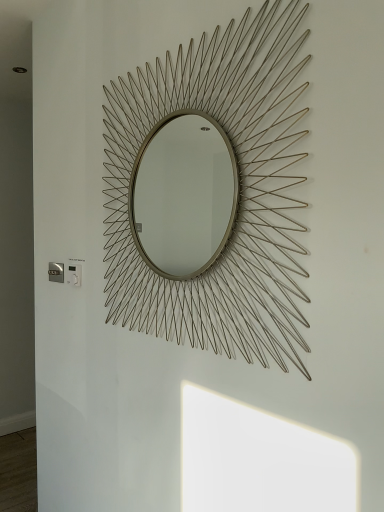
Question: Can you confirm if metallic silver electric outlet at lower left, which appears as the 1th electric outlet when viewed from the back, is shorter than white plastic electric outlet at lower left, which is counted as the 1th electric outlet, starting from the right?

Choices:
 (A) yes
 (B) no

Answer: (A)

Question: Considering the relative sizes of metallic silver electric outlet at lower left, positioned as the second electric outlet in right-to-left order, and white plastic electric outlet at lower left, marked as the first electric outlet in a front-to-back arrangement, in the image provided, is metallic silver electric outlet at lower left, positioned as the second electric outlet in right-to-left order, wider than white plastic electric outlet at lower left, marked as the first electric outlet in a front-to-back arrangement,?

Choices:
 (A) yes
 (B) no

Answer: (B)

Question: Is metallic silver electric outlet at lower left, which appears as the 1th electric outlet when viewed from the back, not close to white plastic electric outlet at lower left, marked as the first electric outlet in a front-to-back arrangement?

Choices:
 (A) no
 (B) yes

Answer: (A)

Question: Does metallic silver electric outlet at lower left, which is the first electric outlet in left-to-right order, have a smaller size compared to white plastic electric outlet at lower left, marked as the first electric outlet in a front-to-back arrangement?

Choices:
 (A) yes
 (B) no

Answer: (B)

Question: Considering the relative sizes of metallic silver electric outlet at lower left, which is the first electric outlet in left-to-right order, and white plastic electric outlet at lower left, marked as the first electric outlet in a front-to-back arrangement, in the image provided, is metallic silver electric outlet at lower left, which is the first electric outlet in left-to-right order, bigger than white plastic electric outlet at lower left, marked as the first electric outlet in a front-to-back arrangement,?

Choices:
 (A) no
 (B) yes

Answer: (B)

Question: From a real-world perspective, relative to gold wire sunburst mirror at center, is metallic silver electric outlet at lower left, positioned as the second electric outlet in right-to-left order, vertically above or below?

Choices:
 (A) below
 (B) above

Answer: (A)

Question: Does point (61, 271) appear closer or farther from the camera than point (182, 298)?

Choices:
 (A) closer
 (B) farther

Answer: (B)

Question: Is metallic silver electric outlet at lower left, which appears as the 1th electric outlet when viewed from the back, spatially inside gold wire sunburst mirror at center, or outside of it?

Choices:
 (A) outside
 (B) inside

Answer: (A)

Question: From their relative heights in the image, would you say metallic silver electric outlet at lower left, positioned as the second electric outlet in right-to-left order, is taller or shorter than gold wire sunburst mirror at center?

Choices:
 (A) short
 (B) tall

Answer: (A)

Question: Considering their positions, is gold wire sunburst mirror at center located in front of or behind metallic silver electric outlet at lower left, which appears as the 1th electric outlet when viewed from the back?

Choices:
 (A) front
 (B) behind

Answer: (A)

Question: Considering the relative positions of gold wire sunburst mirror at center and metallic silver electric outlet at lower left, positioned as the second electric outlet in right-to-left order, in the image provided, is gold wire sunburst mirror at center to the left or to the right of metallic silver electric outlet at lower left, positioned as the second electric outlet in right-to-left order,?

Choices:
 (A) left
 (B) right

Answer: (B)

Question: In terms of width, does gold wire sunburst mirror at center look wider or thinner when compared to metallic silver electric outlet at lower left, which appears as the 1th electric outlet when viewed from the back?

Choices:
 (A) wide
 (B) thin

Answer: (A)

Question: From their relative heights in the image, would you say gold wire sunburst mirror at center is taller or shorter than metallic silver electric outlet at lower left, positioned as the second electric outlet in right-to-left order?

Choices:
 (A) tall
 (B) short

Answer: (A)

Question: Is gold wire sunburst mirror at center in front of or behind white plastic electric outlet at lower left, marked as the first electric outlet in a front-to-back arrangement, in the image?

Choices:
 (A) behind
 (B) front

Answer: (B)

Question: In terms of width, does gold wire sunburst mirror at center look wider or thinner when compared to white plastic electric outlet at lower left, which is counted as the 1th electric outlet, starting from the right?

Choices:
 (A) thin
 (B) wide

Answer: (B)